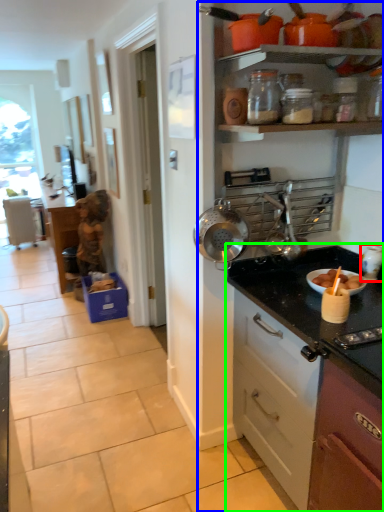
Question: Based on their relative distances, which object is nearer to appliance (highlighted by a red box)? Choose from dresser (highlighted by a blue box) and countertop (highlighted by a green box).

Choices:
 (A) dresser
 (B) countertop

Answer: (B)